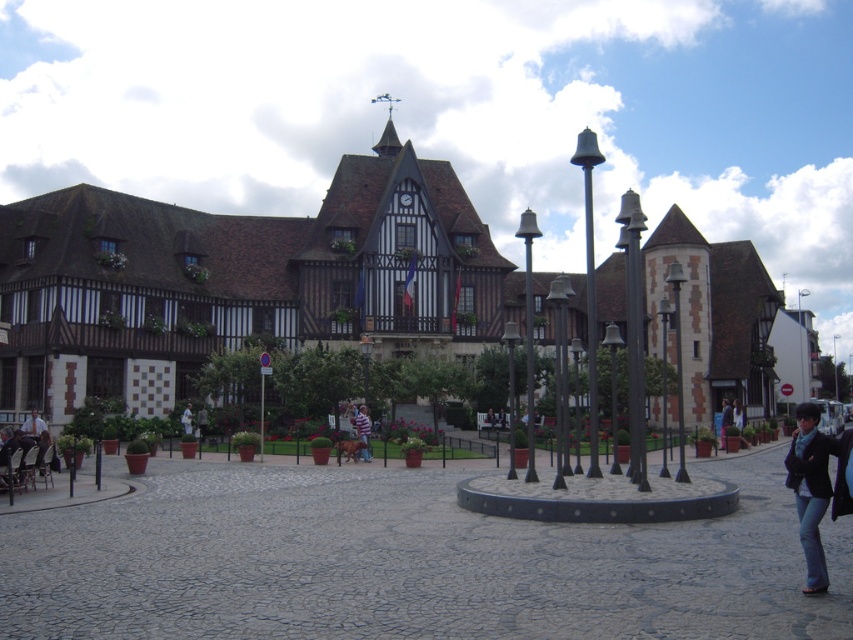
Is point (814, 545) farther from viewer compared to point (192, 426)?

No, (814, 545) is in front of (192, 426).

Can you confirm if denim jeans at lower right is taller than white cotton shirt at center?

Yes.

Between point (799, 538) and point (186, 420), which one is positioned in front?

Positioned in front is point (799, 538).

Find the location of a particular element. The width and height of the screenshot is (853, 640). denim jeans at lower right is located at coordinates (809, 490).

Does striped shirt at center have a smaller size compared to white cotton shirt at center?

No.

Consider the image. Can you confirm if striped shirt at center is wider than white cotton shirt at center?

Yes, striped shirt at center is wider than white cotton shirt at center.

Does point (360, 429) come in front of point (193, 433)?

Yes, it is.

The width and height of the screenshot is (853, 640). Identify the location of striped shirt at center. (363, 432).

Does denim jeans at lower right have a lesser width compared to black leather jacket at lower right?

No.

You are a GUI agent. You are given a task and a screenshot of the screen. Output one action in this format:
    pyautogui.click(x=<x>, y=<y>)
    Task: Click on the denim jeans at lower right
    
    Given the screenshot: What is the action you would take?
    pyautogui.click(x=809, y=490)

The height and width of the screenshot is (640, 853). I want to click on denim jeans at lower right, so click(809, 490).